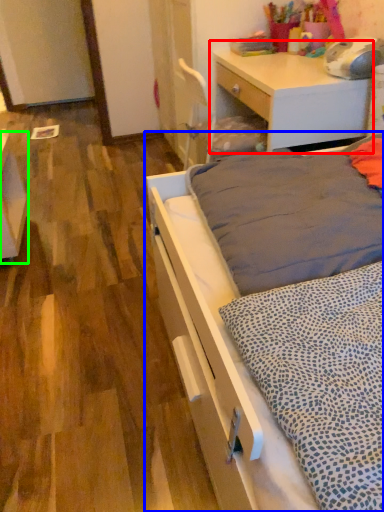
Question: Considering the real-world distances, which object is farthest from desk (highlighted by a red box)? bed (highlighted by a blue box) or vanity (highlighted by a green box)?

Choices:
 (A) bed
 (B) vanity

Answer: (B)